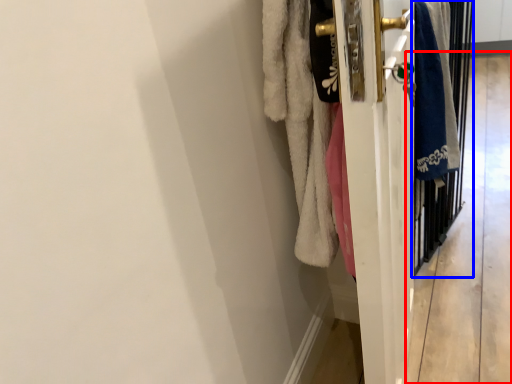
Question: Which point is further to the camera, corridor (highlighted by a red box) or screen door (highlighted by a blue box)?

Choices:
 (A) corridor
 (B) screen door

Answer: (A)